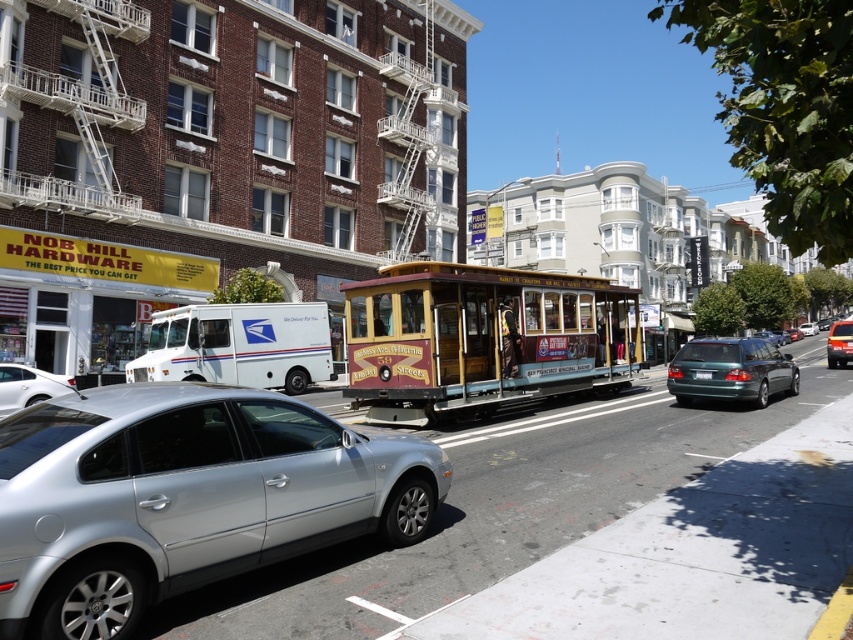
You are a pedestrian standing at the intersection and want to cross the street to reach the cable car. Which object, the silver metallic car at lower left or the wooden polished cable car at center, is closer to your current position?

The silver metallic car at lower left is closer to your current position because it is positioned below the wooden polished cable car at center, indicating it is nearer in the scene.

You are a delivery driver needing to park your truck between the silver metallic sedan at lower left and the metallic silver sedan at center. Can you safely park your truck, which is 15 meters long, in that space?

The distance between the silver metallic sedan at lower left and the metallic silver sedan at center is 31.02 meters. Since your truck is 15 meters long, there is sufficient space to park safely between them.